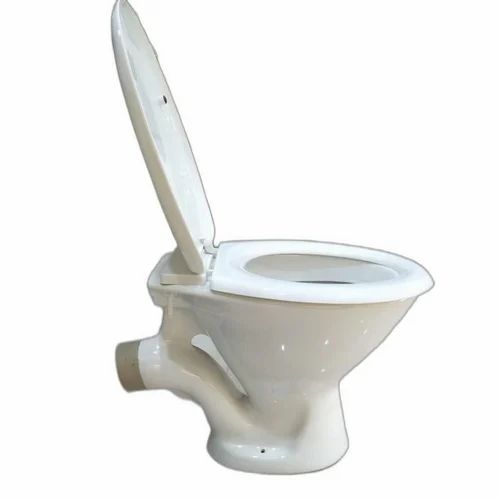
The height and width of the screenshot is (500, 500). I want to click on inner toilet wall, so click(x=311, y=268).